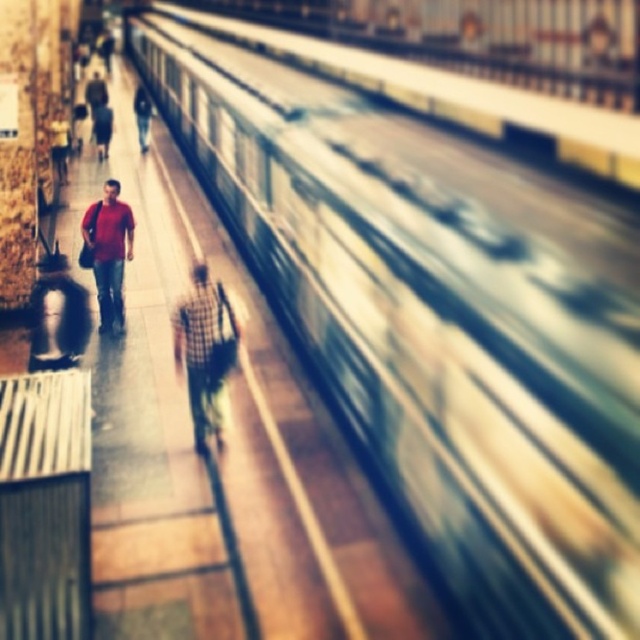
You are standing on the platform and want to hand a note to the person wearing the matte black jacket at upper left and the dark blue jeans at center. Which one can you reach first without moving from your spot?

The matte black jacket at upper left is closer to the viewer than dark blue jeans at center, so you can reach the person wearing the matte black jacket at upper left first without moving.